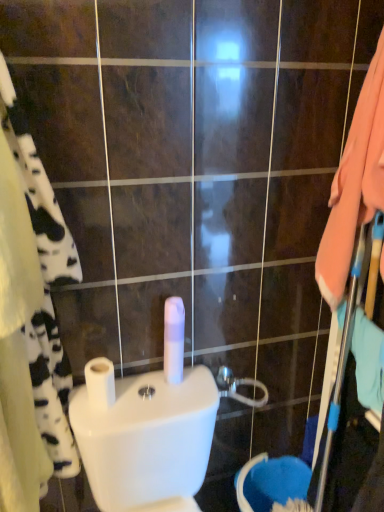
Question: From a real-world perspective, is white matte toilet paper at center, acting as the first toilet paper starting from the right, beneath metallic silver showerhead at center?

Choices:
 (A) yes
 (B) no

Answer: (B)

Question: Is white matte toilet paper at center, acting as the first toilet paper starting from the right, directly adjacent to metallic silver showerhead at center?

Choices:
 (A) yes
 (B) no

Answer: (B)

Question: Does white matte toilet paper at center, the second toilet paper from the left, have a lesser width compared to metallic silver showerhead at center?

Choices:
 (A) yes
 (B) no

Answer: (A)

Question: Can you confirm if white matte toilet paper at center, the second toilet paper from the left, is positioned to the right of metallic silver showerhead at center?

Choices:
 (A) yes
 (B) no

Answer: (B)

Question: Does white matte toilet paper at center, acting as the first toilet paper starting from the right, appear on the left side of metallic silver showerhead at center?

Choices:
 (A) no
 (B) yes

Answer: (B)

Question: From the image's perspective, is white matte toilet paper at center, the second toilet paper from the left, over metallic silver showerhead at center?

Choices:
 (A) yes
 (B) no

Answer: (A)

Question: Considering the relative sizes of white matte toilet paper at center, marked as the 1th toilet paper in a left-to-right arrangement, and metallic silver showerhead at center in the image provided, is white matte toilet paper at center, marked as the 1th toilet paper in a left-to-right arrangement, wider than metallic silver showerhead at center?

Choices:
 (A) yes
 (B) no

Answer: (A)

Question: Does white matte toilet paper at center, the 2th toilet paper viewed from the right, have a lesser height compared to metallic silver showerhead at center?

Choices:
 (A) no
 (B) yes

Answer: (A)

Question: Is white matte toilet paper at center, the 2th toilet paper viewed from the right, far from metallic silver showerhead at center?

Choices:
 (A) yes
 (B) no

Answer: (B)

Question: Considering the relative positions of white matte toilet paper at center, marked as the 1th toilet paper in a left-to-right arrangement, and metallic silver showerhead at center in the image provided, is white matte toilet paper at center, marked as the 1th toilet paper in a left-to-right arrangement, in front of metallic silver showerhead at center?

Choices:
 (A) yes
 (B) no

Answer: (A)

Question: From the image's perspective, would you say white matte toilet paper at center, marked as the 1th toilet paper in a left-to-right arrangement, is shown under metallic silver showerhead at center?

Choices:
 (A) no
 (B) yes

Answer: (A)

Question: From the image's perspective, is white matte toilet paper at center, marked as the 1th toilet paper in a left-to-right arrangement, over metallic silver showerhead at center?

Choices:
 (A) yes
 (B) no

Answer: (A)

Question: Is metallic silver showerhead at center further to camera compared to white cotton bath towel at left?

Choices:
 (A) yes
 (B) no

Answer: (A)